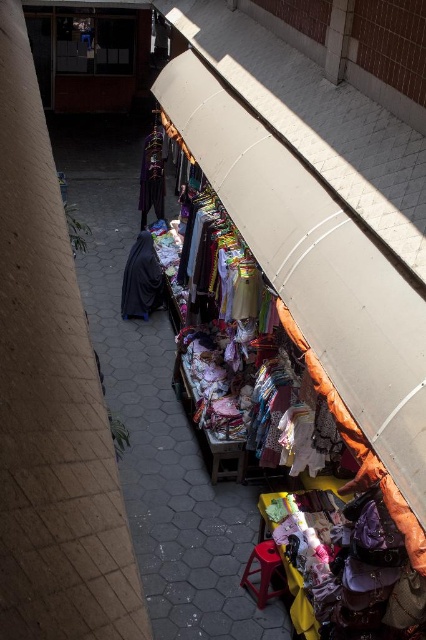
Who is more forward, (140,312) or (143,209)?

Point (140,312) is in front.

Between black matte fabric at center and velvet purple dress at center, which one has less height?

With less height is black matte fabric at center.

Is point (138, 301) positioned behind point (149, 193)?

No, it is in front of (149, 193).

This screenshot has width=426, height=640. I want to click on black matte fabric at center, so click(141, 280).